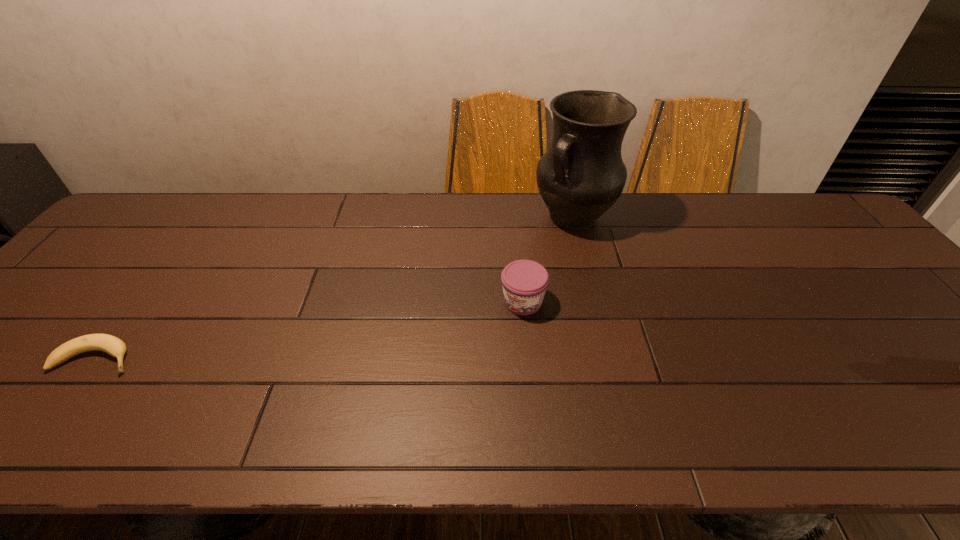
At what (x,y) coordinates should I click in order to perform the action: click on vacant space located on the front label of the second farthest object. Please return your answer as a coordinate pair (x, y). The height and width of the screenshot is (540, 960). Looking at the image, I should click on (504, 335).

Find the location of `vacant area located on the front label of the second farthest object`. vacant area located on the front label of the second farthest object is located at coordinates (495, 350).

Locate an element on the screen. vacant space located 0.060m on the front label of the second farthest object is located at coordinates (504, 335).

Where is `object located in the far edge section of the desktop`? object located in the far edge section of the desktop is located at coordinates (582, 174).

Identify the location of object located at the near edge. (112, 345).

The height and width of the screenshot is (540, 960). Identify the location of object that is at the left edge. (112, 345).

In order to click on object located in the near left corner section of the desktop in this screenshot , I will do click(112, 345).

The image size is (960, 540). I want to click on blank space at the far edge of the desktop, so click(x=709, y=200).

Locate an element on the screen. free region at the near edge is located at coordinates pos(407,392).

Find the location of `vacant space at the left edge of the desktop`. vacant space at the left edge of the desktop is located at coordinates (119, 241).